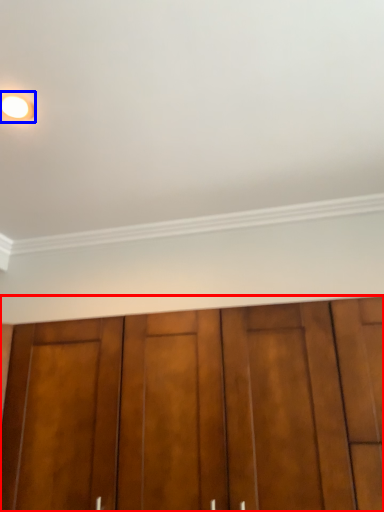
Question: Which of the following is the farthest to the observer, door (highlighted by a red box) or lighting (highlighted by a blue box)?

Choices:
 (A) door
 (B) lighting

Answer: (B)